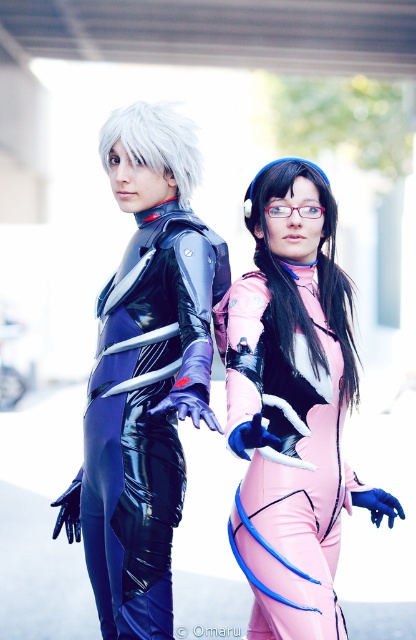
Is pink matte bodysuit at center closer to the viewer compared to glossy black bodysuit at left?

Yes, pink matte bodysuit at center is closer to the viewer.

Is point (331, 346) positioned behind point (126, 332)?

That is False.

Locate an element on the screen. The height and width of the screenshot is (640, 416). pink matte bodysuit at center is located at coordinates (292, 404).

Between shiny black bodysuit at center and glossy black bodysuit at left, which one is positioned higher?

shiny black bodysuit at center

Does shiny black bodysuit at center appear under glossy black bodysuit at left?

Actually, shiny black bodysuit at center is above glossy black bodysuit at left.

Identify the location of shiny black bodysuit at center. The height and width of the screenshot is (640, 416). (232, 378).

Can you confirm if shiny black bodysuit at center is thinner than pink matte bodysuit at center?

No, shiny black bodysuit at center is not thinner than pink matte bodysuit at center.

Does shiny black bodysuit at center appear under pink matte bodysuit at center?

No, shiny black bodysuit at center is not below pink matte bodysuit at center.

Is point (227, 285) farther from viewer compared to point (279, 627)?

Yes, it is behind point (279, 627).

Locate an element on the screen. Image resolution: width=416 pixels, height=640 pixels. shiny black bodysuit at center is located at coordinates (232, 378).